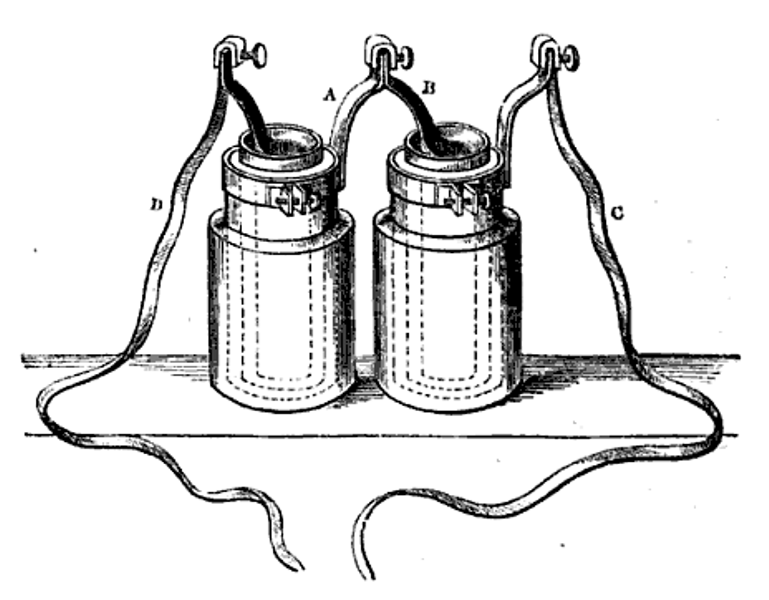
Locate an element on the screen. The height and width of the screenshot is (600, 769). table is located at coordinates (591, 431).